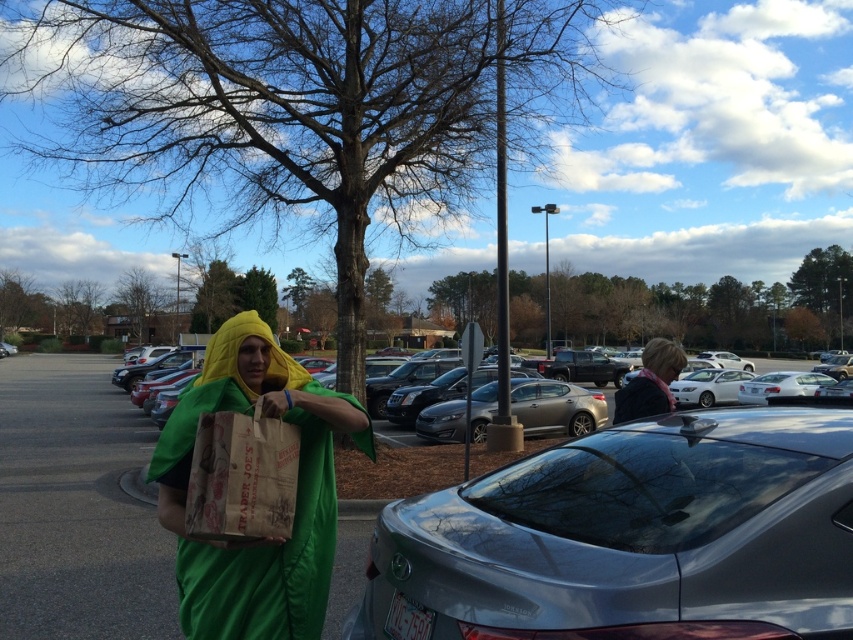
Question: Which object appears farthest from the camera in this image?

Choices:
 (A) metallic silver sedan at center
 (B) matte black jacket at upper right
 (C) matte green costume at center

Answer: (B)

Question: Is metallic silver car at center to the right of matte green costume at center from the viewer's perspective?

Choices:
 (A) no
 (B) yes

Answer: (A)

Question: Which point is farther to the camera?

Choices:
 (A) matte black jacket at upper right
 (B) matte green costume at center
 (C) metallic silver car at center
 (D) metallic silver sedan at center

Answer: (C)

Question: Can you confirm if metallic silver car at center is wider than matte black jacket at upper right?

Choices:
 (A) yes
 (B) no

Answer: (A)

Question: Which object appears farthest from the camera in this image?

Choices:
 (A) metallic silver car at center
 (B) matte black jacket at upper right
 (C) matte green costume at center

Answer: (A)

Question: Can you confirm if metallic silver sedan at center is positioned to the left of metallic silver car at center?

Choices:
 (A) no
 (B) yes

Answer: (A)